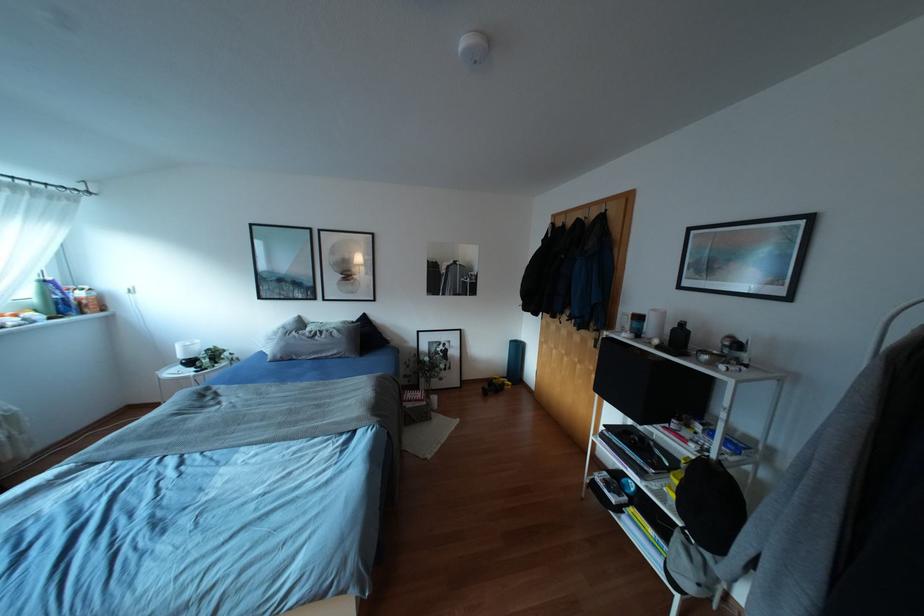
Identify the location of black coat hook. The image size is (924, 616). (593, 212).